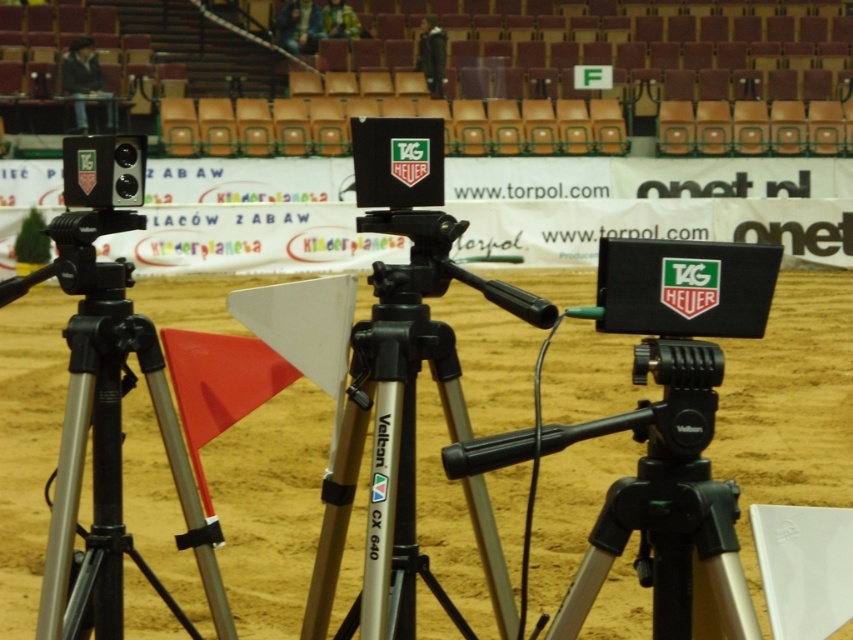
Which is more to the left, black metallic tripod at center or brown sand at center?

brown sand at center

Locate an element on the screen. This screenshot has width=853, height=640. black metallic tripod at center is located at coordinates (402, 406).

Between black metallic tripod at left and brown sand at center, which one appears on the left side from the viewer's perspective?

brown sand at center is more to the left.

Can you confirm if black metallic tripod at left is bigger than brown sand at center?

Incorrect, black metallic tripod at left is not larger than brown sand at center.

Who is more distant from viewer, (97, 628) or (9, 362)?

The point (9, 362) is more distant.

Identify the location of black metallic tripod at left. Image resolution: width=853 pixels, height=640 pixels. (106, 435).

Does black metallic tripod at center have a larger size compared to black metallic tripod at left?

Correct, black metallic tripod at center is larger in size than black metallic tripod at left.

At what (x,y) coordinates should I click in order to perform the action: click on black metallic tripod at center. Please return your answer as a coordinate pair (x, y). The height and width of the screenshot is (640, 853). Looking at the image, I should click on (402, 406).

Does point (393, 520) lie behind point (115, 212)?

No, (393, 520) is in front of (115, 212).

At what (x,y) coordinates should I click in order to perform the action: click on black metallic tripod at center. Please return your answer as a coordinate pair (x, y). Image resolution: width=853 pixels, height=640 pixels. Looking at the image, I should click on (402, 406).